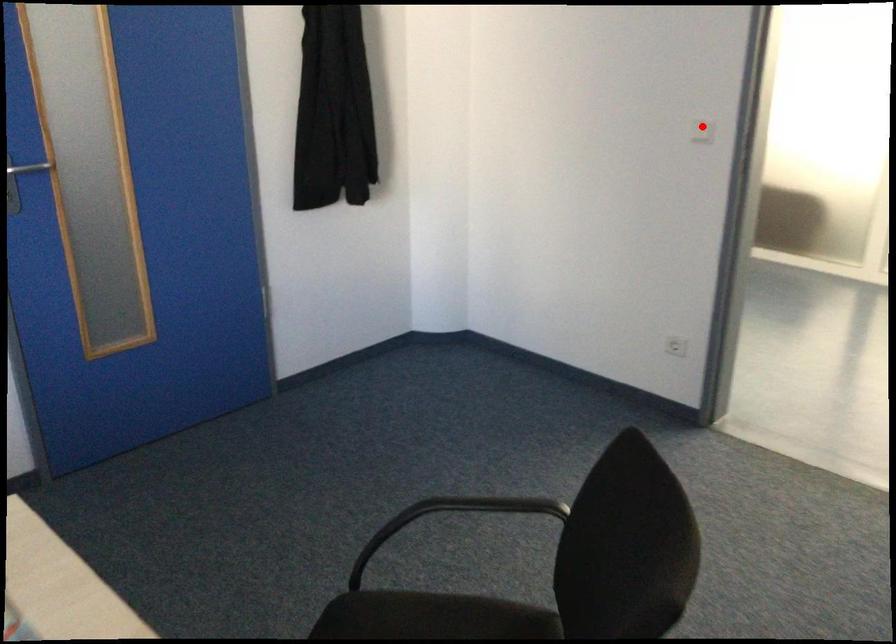
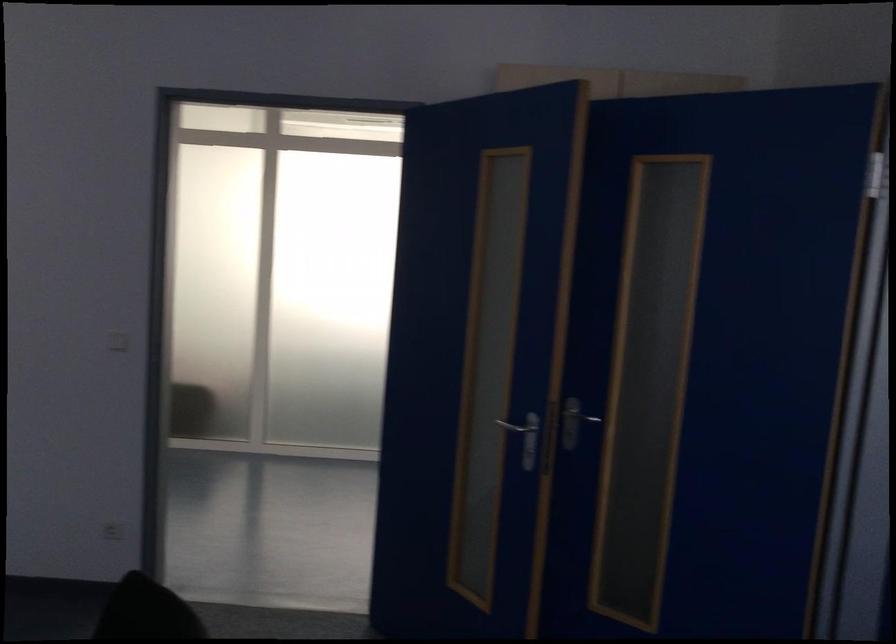
Question: I am providing you with two images of the same scene from different viewpoints. A red point is marked on the first image. At the location where the point appears in image 1, is it still visible in image 2?

Choices:
 (A) Yes
 (B) No

Answer: (A)